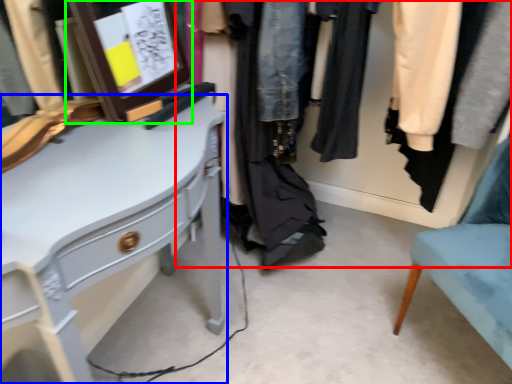
Question: Considering the real-world distances, which object is farthest from closet (highlighted by a red box)? desk (highlighted by a blue box) or picture frame (highlighted by a green box)?

Choices:
 (A) desk
 (B) picture frame

Answer: (A)